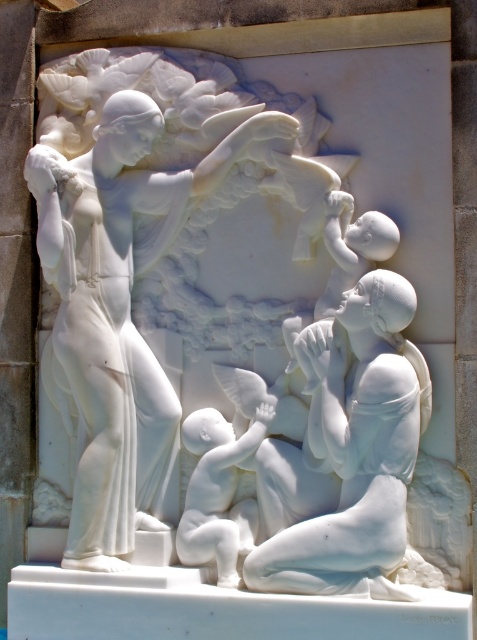
Question: Is white marble statue at center thinner than matte white baby at lower center?

Choices:
 (A) no
 (B) yes

Answer: (A)

Question: Observing the image, what is the correct spatial positioning of white marble statue at center in reference to matte white baby at lower center?

Choices:
 (A) left
 (B) right

Answer: (B)

Question: Which of the following is the closest to the observer?

Choices:
 (A) (209, 460)
 (B) (398, 589)

Answer: (B)

Question: From the image, what is the correct spatial relationship of white marble statue at center in relation to matte white baby at lower center?

Choices:
 (A) above
 (B) below

Answer: (A)